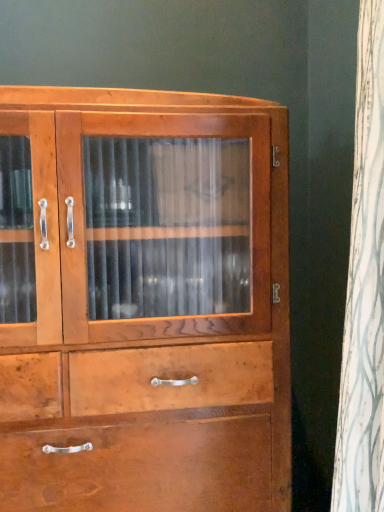
Find the location of a particular element. wooden cabinet at center is located at coordinates (143, 301).

Describe the element at coordinates (143, 301) in the screenshot. I see `wooden cabinet at center` at that location.

Measure the distance between point (x=227, y=139) and camera.

Point (x=227, y=139) is 79.70 centimeters from camera.

What is the approximate width of wooden cabinet at center?

The width of wooden cabinet at center is 45.00 centimeters.

The width and height of the screenshot is (384, 512). In order to click on wooden cabinet at center in this screenshot , I will do `click(143, 301)`.